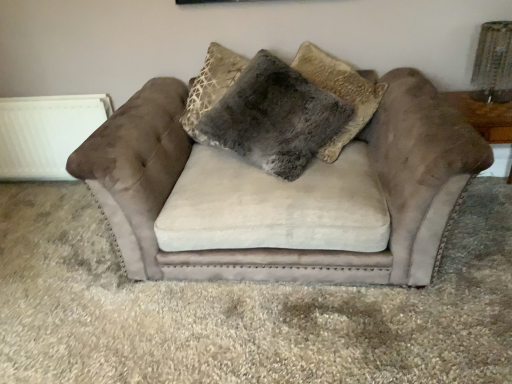
Question: In the image, is suede couch at center positioned in front of or behind brown suede table at right?

Choices:
 (A) front
 (B) behind

Answer: (A)

Question: Visually, is suede couch at center positioned to the left or to the right of brown suede table at right?

Choices:
 (A) right
 (B) left

Answer: (B)

Question: Based on their relative distances, which object is farther from the fuzzy gray pillow at center?

Choices:
 (A) suede couch at center
 (B) white matte radiator at left
 (C) brown suede table at right

Answer: (B)

Question: Based on their relative distances, which object is nearer to the brown suede table at right?

Choices:
 (A) white matte radiator at left
 (B) fuzzy gray pillow at center
 (C) suede couch at center

Answer: (B)